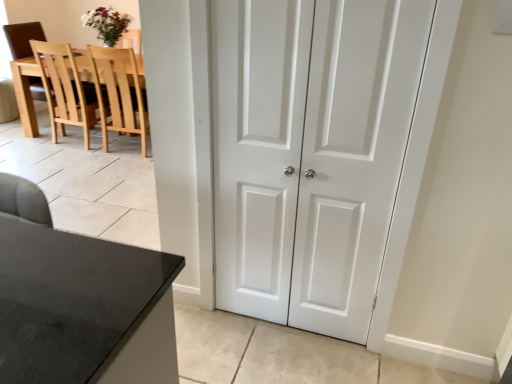
The image size is (512, 384). I want to click on light wood chair at upper left, arranged as the first chair when viewed from the right, so tap(119, 93).

Measure the distance between white matte door at center and camera.

white matte door at center is 1.44 meters away from camera.

Locate an element on the screen. The height and width of the screenshot is (384, 512). light wood chair at upper left, the second chair viewed from the left is located at coordinates (119, 93).

Is light wood chair at upper left, arranged as the first chair when viewed from the right, surrounding white matte door at center?

No, white matte door at center is not a part of light wood chair at upper left, arranged as the first chair when viewed from the right.

Is light wood chair at upper left, arranged as the first chair when viewed from the right, looking in the opposite direction of white matte door at center?

No.

Is light wood chair at upper left, the second chair viewed from the left, far away from white matte door at center?

Absolutely, light wood chair at upper left, the second chair viewed from the left, is distant from white matte door at center.

Considering the sizes of objects light wood chair at upper left, arranged as the first chair when viewed from the right, and white matte door at center in the image provided, who is smaller, light wood chair at upper left, arranged as the first chair when viewed from the right, or white matte door at center?

white matte door at center.

Which object is closer to the camera, white matte door at center or white smooth door at center?

white smooth door at center is more forward.

Is white smooth door at center at the back of white matte door at center?

That's right, white matte door at center is facing away from white smooth door at center.

Between point (244, 204) and point (229, 213), which one is positioned behind?

The point (229, 213) is behind.

From the image's perspective, who appears lower, white matte door at center or white smooth door at center?

white smooth door at center, from the image's perspective.

From a real-world perspective, does light brown wood chair at left, the 2th chair in the right-to-left sequence, stand above white smooth door at center?

No, from a real-world perspective, light brown wood chair at left, the 2th chair in the right-to-left sequence, is not over white smooth door at center

From the image's perspective, which object appears higher, light brown wood chair at left, which is counted as the first chair, starting from the left, or white smooth door at center?

light brown wood chair at left, which is counted as the first chair, starting from the left, from the image's perspective.

Based on their sizes in the image, would you say light brown wood chair at left, the 2th chair in the right-to-left sequence, is bigger or smaller than white smooth door at center?

Clearly, light brown wood chair at left, the 2th chair in the right-to-left sequence, is larger in size than white smooth door at center.

Considering the relative positions of white smooth door at center and light brown wood chair at left, the 2th chair in the right-to-left sequence, in the image provided, is white smooth door at center to the right of light brown wood chair at left, the 2th chair in the right-to-left sequence, from the viewer's perspective?

Yes, white smooth door at center is to the right of light brown wood chair at left, the 2th chair in the right-to-left sequence.

Which of these two, white smooth door at center or light brown wood chair at left, the 2th chair in the right-to-left sequence, stands shorter?

light brown wood chair at left, the 2th chair in the right-to-left sequence, is shorter.

Considering the relative sizes of white smooth door at center and light brown wood chair at left, the 2th chair in the right-to-left sequence, in the image provided, is white smooth door at center bigger than light brown wood chair at left, the 2th chair in the right-to-left sequence,?

No.

Measure the distance between white smooth door at center and light brown wood chair at left, which is counted as the first chair, starting from the left.

white smooth door at center and light brown wood chair at left, which is counted as the first chair, starting from the left, are 3.58 meters apart from each other.

Considering their positions, is white smooth door at center located in front of or behind light wood chair at upper left, arranged as the first chair when viewed from the right?

Clearly, white smooth door at center is in front of light wood chair at upper left, arranged as the first chair when viewed from the right.

The image size is (512, 384). There is a light wood chair at upper left, arranged as the first chair when viewed from the right. What are the coordinates of `door above it (from a real-world perspective)` in the screenshot? It's located at (311, 153).

Can you confirm if white smooth door at center is thinner than light wood chair at upper left, arranged as the first chair when viewed from the right?

Indeed, white smooth door at center has a lesser width compared to light wood chair at upper left, arranged as the first chair when viewed from the right.

Does point (142, 147) appear closer or farther from the camera than point (20, 23)?

Point (142, 147) is positioned closer to the camera compared to point (20, 23).

What's the angular difference between light wood chair at upper left, the second chair viewed from the left, and light brown wood chair at left, the 2th chair in the right-to-left sequence,'s facing directions?

The facing directions of light wood chair at upper left, the second chair viewed from the left, and light brown wood chair at left, the 2th chair in the right-to-left sequence, are 97.3 degrees apart.

Considering the sizes of light wood chair at upper left, arranged as the first chair when viewed from the right, and light brown wood chair at left, which is counted as the first chair, starting from the left, in the image, is light wood chair at upper left, arranged as the first chair when viewed from the right, bigger or smaller than light brown wood chair at left, which is counted as the first chair, starting from the left,?

Clearly, light wood chair at upper left, arranged as the first chair when viewed from the right, is smaller in size than light brown wood chair at left, which is counted as the first chair, starting from the left.

How many degrees apart are the facing directions of white matte door at center and light brown wood chair at left, which is counted as the first chair, starting from the left?

The angular difference between white matte door at center and light brown wood chair at left, which is counted as the first chair, starting from the left, is 81.2 degrees.

Is light brown wood chair at left, which is counted as the first chair, starting from the left, a part of white matte door at center?

Definitely not — light brown wood chair at left, which is counted as the first chair, starting from the left, is not inside white matte door at center.

Between point (271, 239) and point (34, 85), which one is positioned behind?

Point (34, 85)

From the image's perspective, is white matte door at center over light brown wood chair at left, the 2th chair in the right-to-left sequence?

No, from the image's perspective, white matte door at center is not above light brown wood chair at left, the 2th chair in the right-to-left sequence.

The image size is (512, 384). I want to click on screen door located below the light wood chair at upper left, arranged as the first chair when viewed from the right (from the image's perspective), so 257,148.

Image resolution: width=512 pixels, height=384 pixels. There is a white smooth door at center. In order to click on screen door above it (from a real-world perspective) in this screenshot , I will do `click(257, 148)`.

From the image, which object appears to be nearer to light brown wood chair at left, which is counted as the first chair, starting from the left, light wood chair at upper left, arranged as the first chair when viewed from the right, or white matte door at center?

light wood chair at upper left, arranged as the first chair when viewed from the right, is positioned closer to the anchor light brown wood chair at left, which is counted as the first chair, starting from the left.

When comparing their distances from white matte door at center, does white smooth door at center or light wood chair at upper left, the second chair viewed from the left, seem closer?

Among the two, white smooth door at center is located nearer to white matte door at center.

Which object lies further to the anchor point white smooth door at center, light wood chair at upper left, arranged as the first chair when viewed from the right, or white matte door at center?

Among the two, light wood chair at upper left, arranged as the first chair when viewed from the right, is located further to white smooth door at center.

Which object lies further to the anchor point white matte door at center, light wood chair at upper left, the second chair viewed from the left, or light brown wood chair at left, which is counted as the first chair, starting from the left?

The object further to white matte door at center is light brown wood chair at left, which is counted as the first chair, starting from the left.

Considering their positions, is white matte door at center positioned closer to light wood chair at upper left, the second chair viewed from the left, than white smooth door at center?

Based on the image, white matte door at center appears to be nearer to light wood chair at upper left, the second chair viewed from the left.

From the picture: Looking at the image, which one is located closer to white smooth door at center, white matte door at center or light brown wood chair at left, the 2th chair in the right-to-left sequence?

Based on the image, white matte door at center appears to be nearer to white smooth door at center.

Which object lies further to the anchor point light brown wood chair at left, which is counted as the first chair, starting from the left, white matte door at center or white smooth door at center?

white smooth door at center is positioned further to the anchor light brown wood chair at left, which is counted as the first chair, starting from the left.

Looking at the image, which one is located closer to light brown wood chair at left, the 2th chair in the right-to-left sequence, white smooth door at center or white matte door at center?

The object closer to light brown wood chair at left, the 2th chair in the right-to-left sequence, is white matte door at center.

Where is `screen door positioned between white smooth door at center and light wood chair at upper left, the second chair viewed from the left, from near to far`? screen door positioned between white smooth door at center and light wood chair at upper left, the second chair viewed from the left, from near to far is located at coordinates (257, 148).

Locate an element on the screen. The image size is (512, 384). chair between white matte door at center and light brown wood chair at left, the 2th chair in the right-to-left sequence, from front to back is located at coordinates 119,93.

In order to click on chair between white smooth door at center and light brown wood chair at left, the 2th chair in the right-to-left sequence, in the front-back direction in this screenshot , I will do `click(119, 93)`.

Find the location of a particular element. This screenshot has width=512, height=384. screen door located between white smooth door at center and light brown wood chair at left, the 2th chair in the right-to-left sequence, in the depth direction is located at coordinates (257, 148).